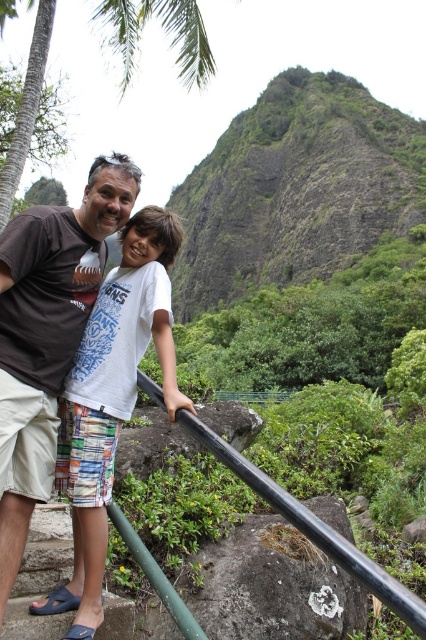
Based on the scene description, what are the coordinates of the green rocky mountain at upper center?

The green rocky mountain at upper center is located at coordinates point (296, 188).